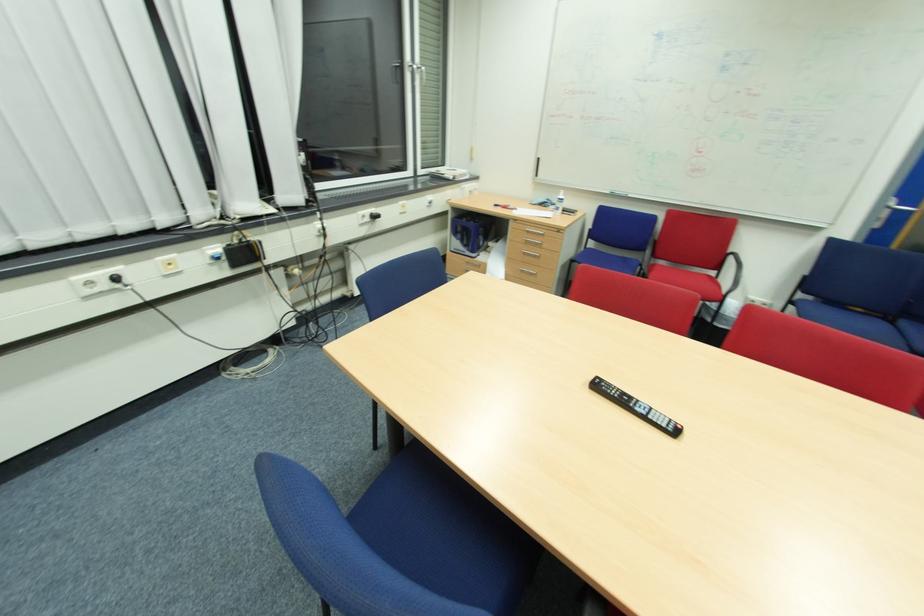
This screenshot has height=616, width=924. Identify the location of window handle. (424, 75).